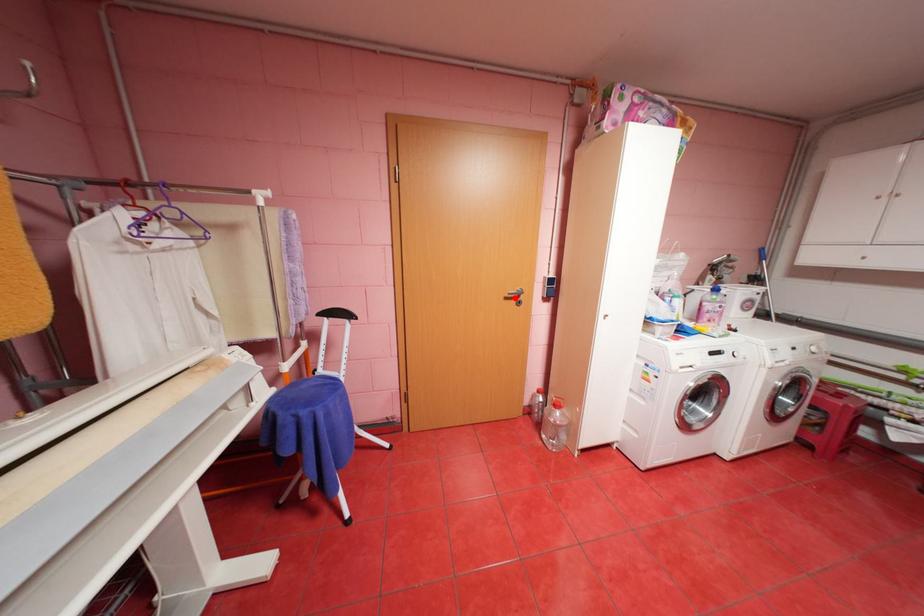
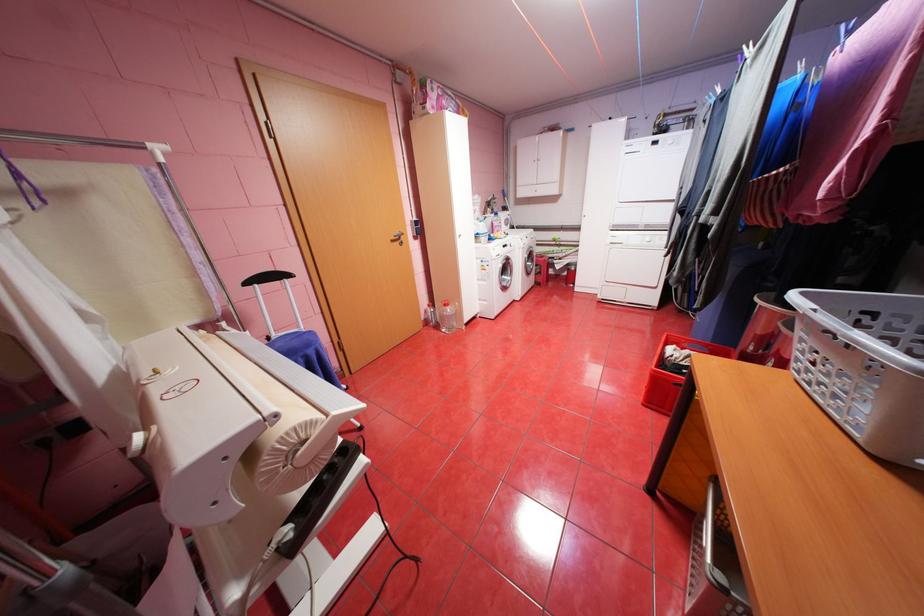
Question: I am providing you with two images of the same scene from different viewpoints. A red point is shown in image1. For the corresponding object point in image2, is it positioned nearer or farther from the camera?

Choices:
 (A) Nearer
 (B) Farther

Answer: (A)